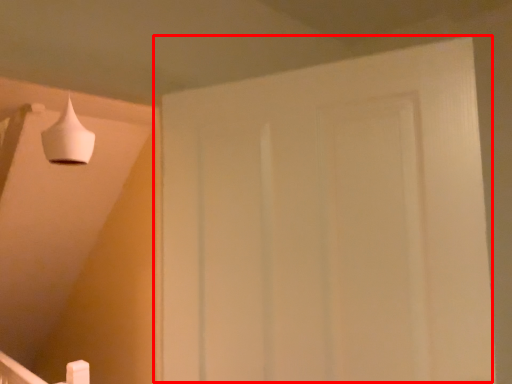
Question: From the image's perspective, what is the correct spatial positioning of door (annotated by the red box) in reference to lamp?

Choices:
 (A) above
 (B) below

Answer: (B)